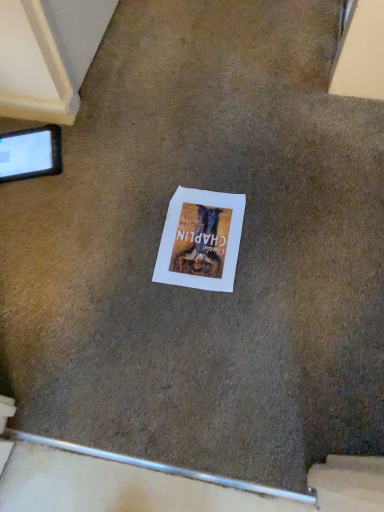
Question: Looking at their shapes, would you say black glossy tablet at upper left is wider or thinner than white paper at center?

Choices:
 (A) thin
 (B) wide

Answer: (A)

Question: Does point (43, 134) appear closer or farther from the camera than point (223, 244)?

Choices:
 (A) farther
 (B) closer

Answer: (A)

Question: From the image's perspective, relative to white paper at center, is black glossy tablet at upper left above or below?

Choices:
 (A) below
 (B) above

Answer: (B)

Question: Considering the positions of white paper at center and black glossy tablet at upper left in the image, is white paper at center taller or shorter than black glossy tablet at upper left?

Choices:
 (A) tall
 (B) short

Answer: (B)

Question: From the image's perspective, is white paper at center located above or below black glossy tablet at upper left?

Choices:
 (A) below
 (B) above

Answer: (A)

Question: From a real-world perspective, relative to black glossy tablet at upper left, is white paper at center vertically above or below?

Choices:
 (A) above
 (B) below

Answer: (B)

Question: Does point (210, 199) appear closer or farther from the camera than point (11, 155)?

Choices:
 (A) farther
 (B) closer

Answer: (B)